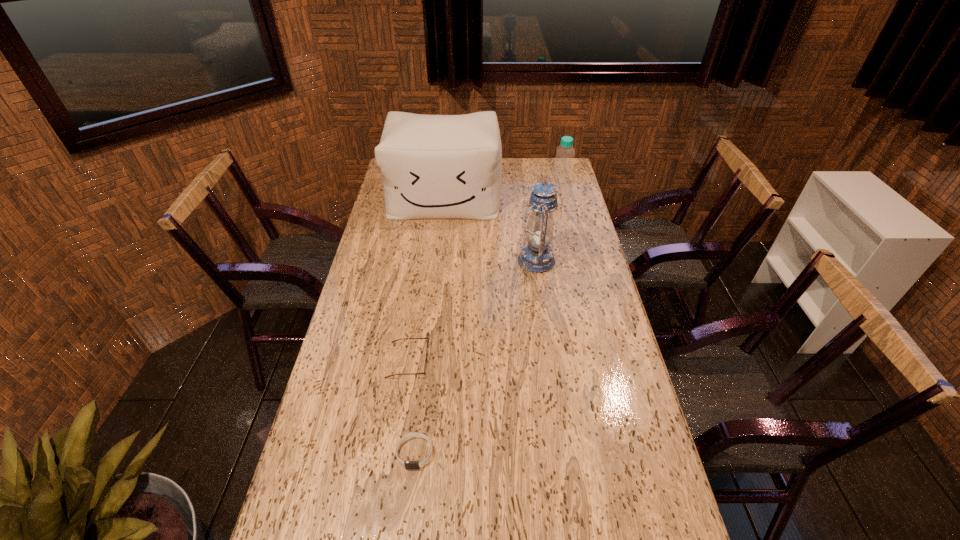
You are a GUI agent. You are given a task and a screenshot of the screen. Output one action in this format:
    pyautogui.click(x=<x>, y=<y>)
    Task: Click on the vacant space located 0.220m on the front-facing side of the lantern
    
    Given the screenshot: What is the action you would take?
    pyautogui.click(x=459, y=260)

Find the location of a particular element. vacant space located on the left of the rightmost object is located at coordinates (487, 179).

This screenshot has width=960, height=540. Identify the location of free space located on the outer surface of the wristband. (406, 533).

The height and width of the screenshot is (540, 960). Identify the location of free spot located on the front-facing side of the fourth farthest object. (512, 361).

Locate an element on the screen. This screenshot has height=540, width=960. cushion positioned at the far edge is located at coordinates (432, 166).

This screenshot has width=960, height=540. I want to click on bottle located in the far edge section of the desktop, so click(563, 167).

Locate an element on the screen. cushion that is at the left edge is located at coordinates [432, 166].

Identify the location of spectacles that is at the left edge. The height and width of the screenshot is (540, 960). (427, 338).

This screenshot has width=960, height=540. In order to click on lantern located in the right edge section of the desktop in this screenshot , I will do `click(536, 256)`.

I want to click on bottle that is at the right edge, so click(x=563, y=167).